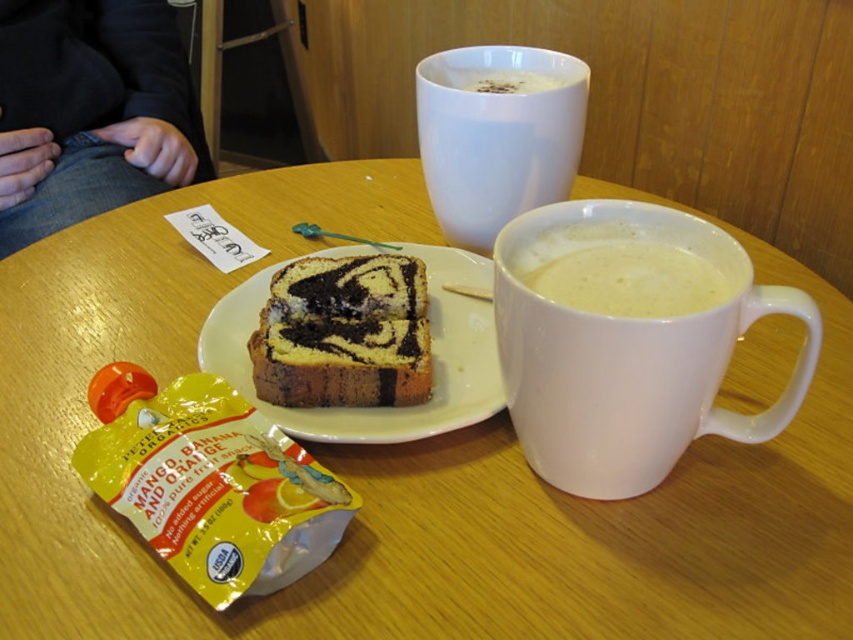
Image resolution: width=853 pixels, height=640 pixels. Identify the location of swirled chocolate cake at center. (344, 333).

How far apart are swirled chocolate cake at center and yellow matte plastic at center?

swirled chocolate cake at center is 1.01 inches away from yellow matte plastic at center.

Where is `swirled chocolate cake at center`? This screenshot has width=853, height=640. swirled chocolate cake at center is located at coordinates (344, 333).

Locate an element on the screen. The height and width of the screenshot is (640, 853). swirled chocolate cake at center is located at coordinates (344, 333).

Can you confirm if white matte mug at upper center is smaller than white matte mug at right?

No, white matte mug at upper center is not smaller than white matte mug at right.

Does white matte mug at upper center appear on the right side of white matte mug at right?

No, white matte mug at upper center is not to the right of white matte mug at right.

Where is `white matte mug at upper center`? Image resolution: width=853 pixels, height=640 pixels. white matte mug at upper center is located at coordinates (497, 134).

Where is `white matte mug at upper center`? The width and height of the screenshot is (853, 640). white matte mug at upper center is located at coordinates (497, 134).

Is swirled chocolate cake at center bigger than white matte mug at right?

Correct, swirled chocolate cake at center is larger in size than white matte mug at right.

Who is taller, swirled chocolate cake at center or white matte mug at right?

With more height is swirled chocolate cake at center.

The image size is (853, 640). Find the location of `swirled chocolate cake at center`. swirled chocolate cake at center is located at coordinates (344, 333).